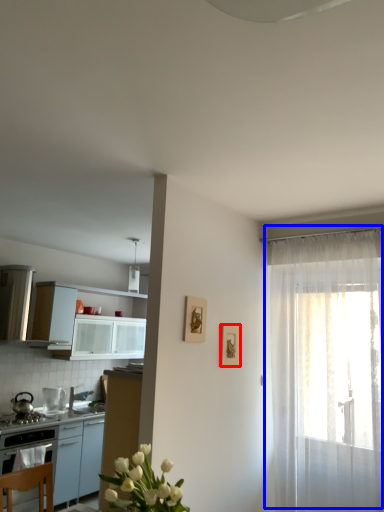
Question: Among these objects, which one is farthest to the camera, picture frame (highlighted by a red box) or curtain (highlighted by a blue box)?

Choices:
 (A) picture frame
 (B) curtain

Answer: (A)